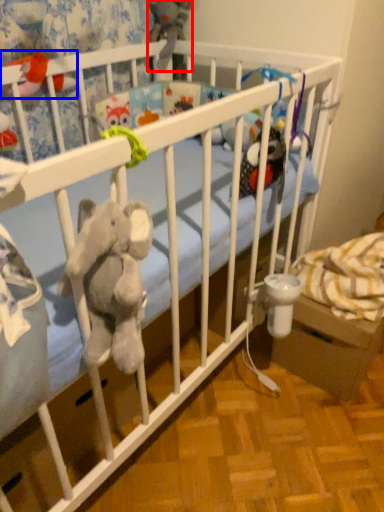
Question: Which object is closer to the camera taking this photo, toy (highlighted by a red box) or toy (highlighted by a blue box)?

Choices:
 (A) toy
 (B) toy

Answer: (B)